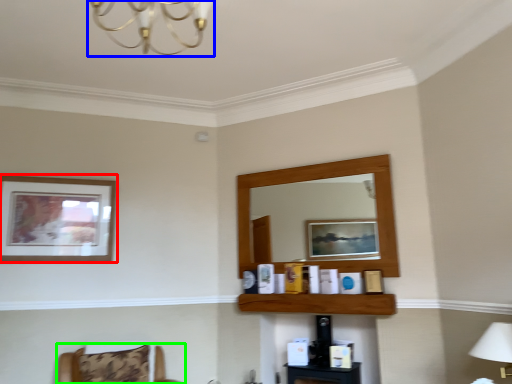
Question: Which object is the closest to the picture frame (highlighted by a red box)? Choose among these: light fixture (highlighted by a blue box) or furniture (highlighted by a green box).

Choices:
 (A) light fixture
 (B) furniture

Answer: (B)